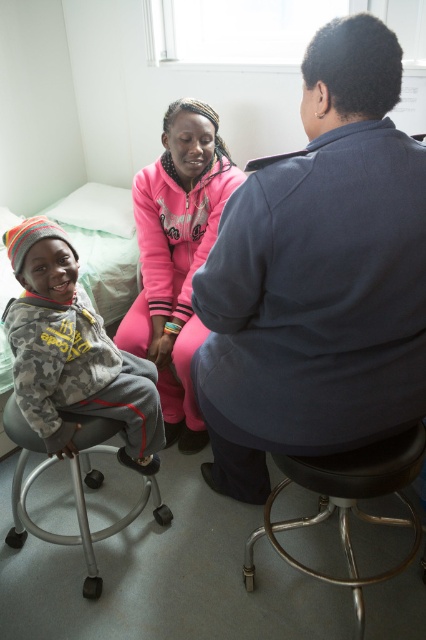
Does point (308, 122) lie behind point (158, 186)?

That is False.

Does point (422, 416) come in front of point (135, 346)?

Yes, point (422, 416) is closer to viewer.

This screenshot has width=426, height=640. In order to click on dark blue uniform at center in this screenshot , I will do `click(319, 276)`.

This screenshot has height=640, width=426. I want to click on dark blue uniform at center, so click(x=319, y=276).

What do you see at coordinates (319, 276) in the screenshot?
I see `dark blue uniform at center` at bounding box center [319, 276].

Find the location of `dark blue uniform at center`. dark blue uniform at center is located at coordinates click(319, 276).

Is pink fleece jacket at center below black metal bar stool at lower center?

No, pink fleece jacket at center is not below black metal bar stool at lower center.

Which is below, pink fleece jacket at center or black metal bar stool at lower center?

black metal bar stool at lower center is below.

Is point (172, 422) in front of point (348, 540)?

That is False.

Locate an element on the screen. The height and width of the screenshot is (640, 426). pink fleece jacket at center is located at coordinates (176, 257).